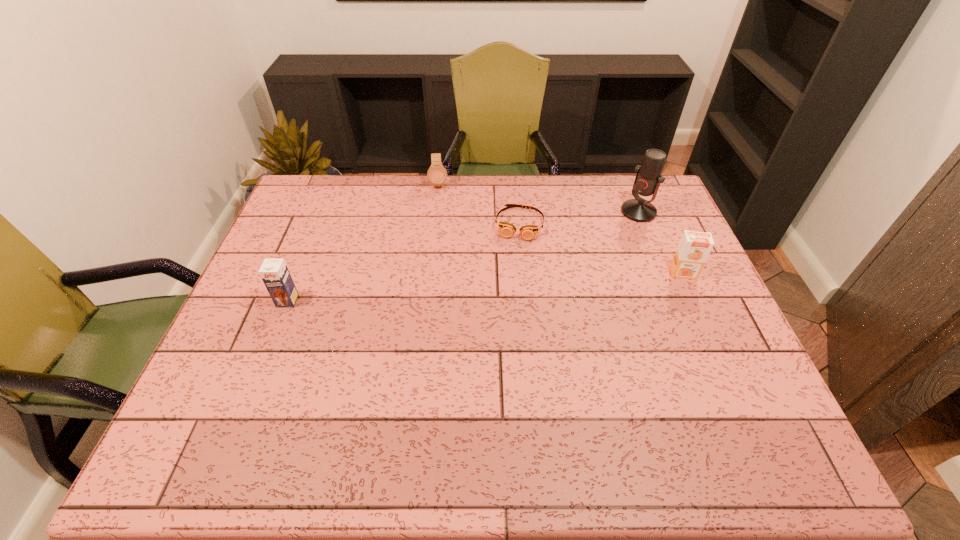
At what (x,y) coordinates should I click in order to perform the action: click on goggles that is at the far edge. Please return your answer as a coordinate pair (x, y). Looking at the image, I should click on click(528, 232).

Locate an element on the screen. The height and width of the screenshot is (540, 960). watch present at the far edge is located at coordinates (437, 175).

I want to click on object positioned at the left edge, so click(274, 272).

The image size is (960, 540). Find the location of `orange juice located in the right edge section of the desktop`. orange juice located in the right edge section of the desktop is located at coordinates (694, 247).

The width and height of the screenshot is (960, 540). What are the coordinates of `microphone located in the right edge section of the desktop` in the screenshot? It's located at (648, 178).

You are a GUI agent. You are given a task and a screenshot of the screen. Output one action in this format:
    pyautogui.click(x=<x>, y=<y>)
    Task: Click on the object positioned at the far right corner
    
    Given the screenshot: What is the action you would take?
    pos(648,178)

Where is `vacant point at the far edge`? The width and height of the screenshot is (960, 540). vacant point at the far edge is located at coordinates (588, 201).

Image resolution: width=960 pixels, height=540 pixels. What are the coordinates of `free space at the near edge` in the screenshot? It's located at (444, 380).

The image size is (960, 540). Identify the location of free space at the left edge of the desktop. (269, 336).

The height and width of the screenshot is (540, 960). Find the location of `blank space at the right edge`. blank space at the right edge is located at coordinates (722, 336).